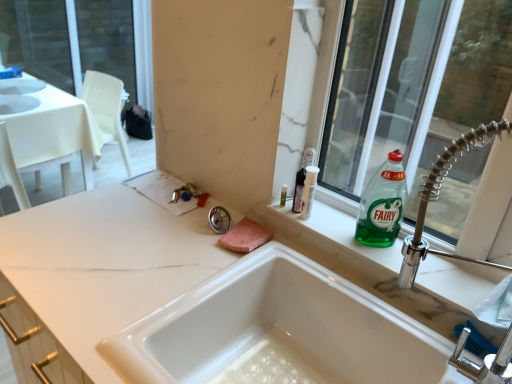
I want to click on vacant space behind green glass bottle at upper right, so click(x=344, y=217).